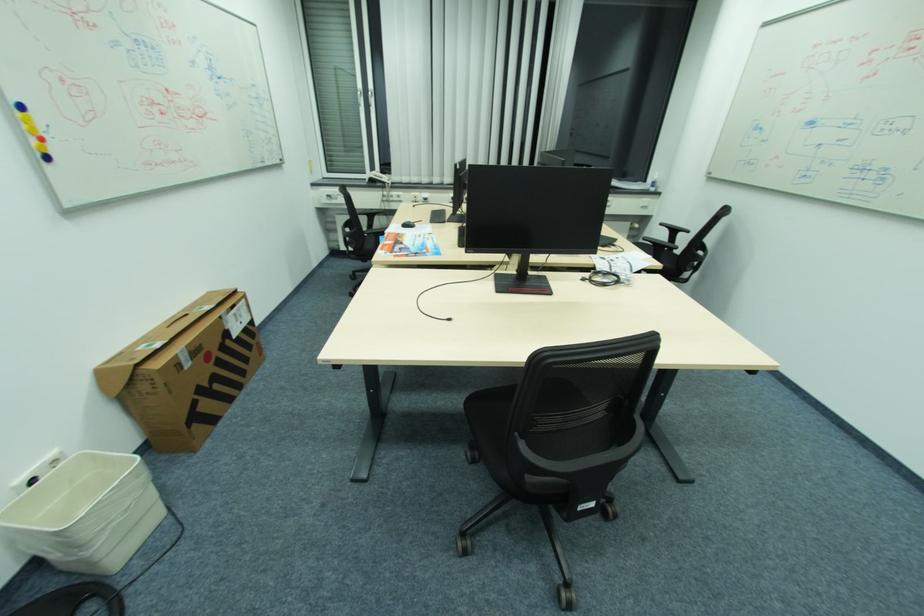
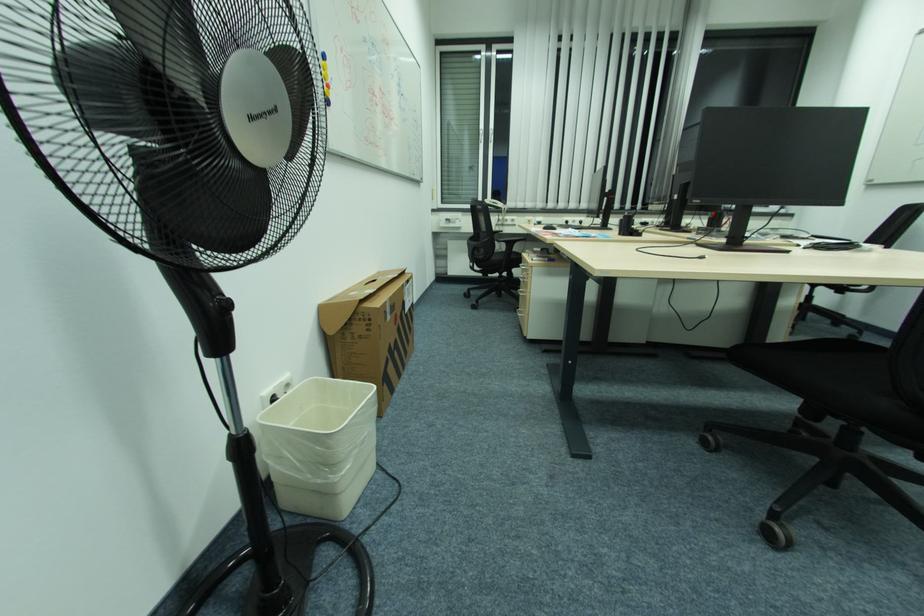
Question: Which direction would the cameraman need to move to produce the second image? Reply with the corresponding letter.

Choices:
 (A) Left
 (B) Right
 (C) Forward
 (D) Backward

Answer: (A)